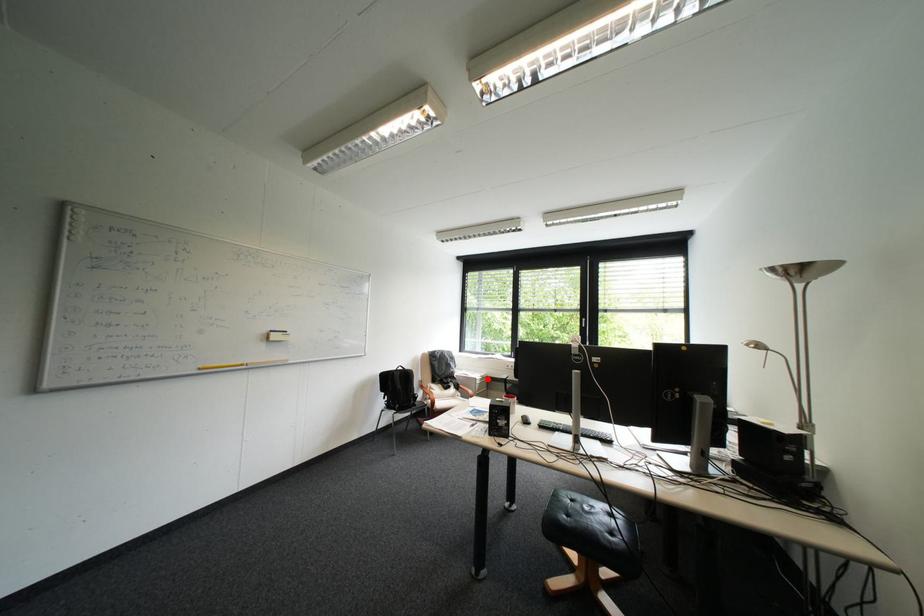
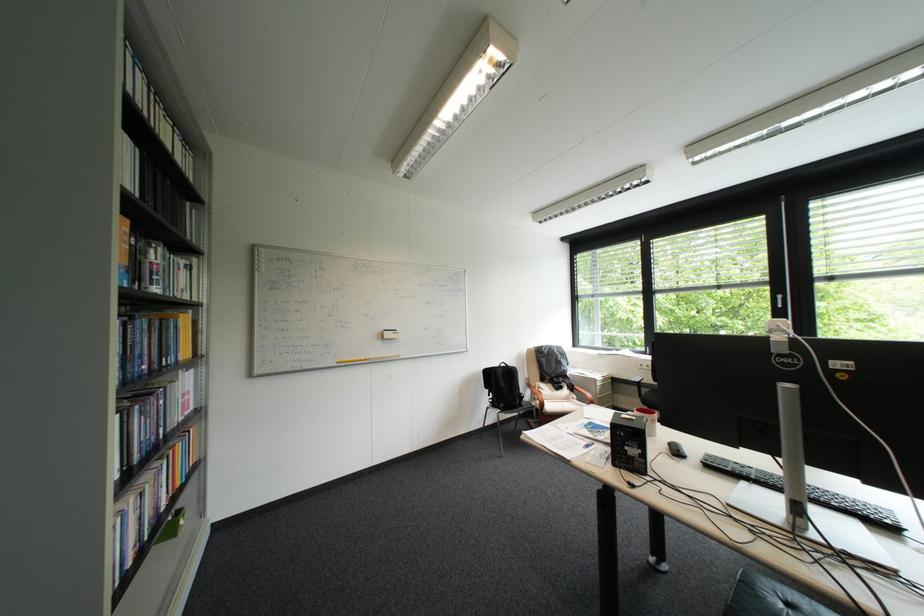
Locate, in the second image, the point that corresponds to the highlighted location in the first image.

(608, 379)